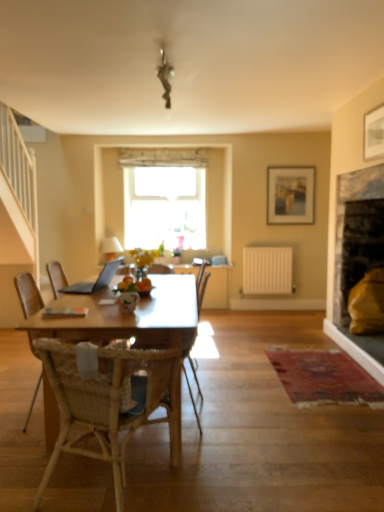
Question: Can you confirm if matte wooden picture frame at upper center, the second picture frame positioned from the right, is thinner than transparent glass window at center?

Choices:
 (A) yes
 (B) no

Answer: (A)

Question: Is matte wooden picture frame at upper center, the first picture frame positioned from the left, to the left of transparent glass window at center from the viewer's perspective?

Choices:
 (A) no
 (B) yes

Answer: (A)

Question: Does matte wooden picture frame at upper center, the 2th picture frame from the front, have a lesser height compared to transparent glass window at center?

Choices:
 (A) no
 (B) yes

Answer: (B)

Question: From a real-world perspective, does matte wooden picture frame at upper center, which appears as the first picture frame when viewed from the back, stand above transparent glass window at center?

Choices:
 (A) no
 (B) yes

Answer: (B)

Question: Is matte wooden picture frame at upper center, the second picture frame positioned from the right, positioned with its back to transparent glass window at center?

Choices:
 (A) yes
 (B) no

Answer: (B)

Question: Is matte wooden picture frame at upper center, the 2th picture frame from the front, facing towards transparent glass window at center?

Choices:
 (A) no
 (B) yes

Answer: (A)

Question: Can you confirm if white matte radiator at center-right is positioned to the left of woven wood chair at center, the 1th chair when ordered from back to front?

Choices:
 (A) yes
 (B) no

Answer: (B)

Question: Can you confirm if white matte radiator at center-right is thinner than woven wood chair at center, the 1th chair when ordered from back to front?

Choices:
 (A) no
 (B) yes

Answer: (B)

Question: Considering the relative sizes of white matte radiator at center-right and woven wood chair at center, the 1th chair when ordered from back to front, in the image provided, is white matte radiator at center-right smaller than woven wood chair at center, the 1th chair when ordered from back to front,?

Choices:
 (A) yes
 (B) no

Answer: (A)

Question: Does white matte radiator at center-right lie in front of woven wood chair at center, the 1th chair when ordered from back to front?

Choices:
 (A) yes
 (B) no

Answer: (B)

Question: Is white matte radiator at center-right surrounding woven wood chair at center, the 3th chair when ordered from front to back?

Choices:
 (A) yes
 (B) no

Answer: (B)

Question: Can you confirm if white matte radiator at center-right is shorter than woven wood chair at center, the 3th chair when ordered from front to back?

Choices:
 (A) no
 (B) yes

Answer: (B)

Question: Is silver metallic laptop at center turned away from white matte radiator at center-right?

Choices:
 (A) yes
 (B) no

Answer: (B)